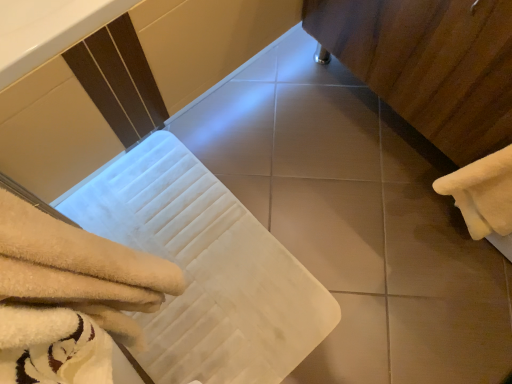
Question: From a real-world perspective, is white fluffy towel at lower left, arranged as the first towel when viewed from the left, located higher than wooden cabinet at right?

Choices:
 (A) yes
 (B) no

Answer: (A)

Question: Can you confirm if white fluffy towel at lower left, arranged as the first towel when viewed from the left, is taller than wooden cabinet at right?

Choices:
 (A) yes
 (B) no

Answer: (A)

Question: Does white fluffy towel at lower left, arranged as the first towel when viewed from the left, contain wooden cabinet at right?

Choices:
 (A) no
 (B) yes

Answer: (A)

Question: Is the position of white fluffy towel at lower left, arranged as the first towel when viewed from the left, more distant than that of wooden cabinet at right?

Choices:
 (A) yes
 (B) no

Answer: (B)

Question: From the image's perspective, is white fluffy towel at lower left, arranged as the first towel when viewed from the left, located above wooden cabinet at right?

Choices:
 (A) yes
 (B) no

Answer: (B)

Question: Would you say wooden cabinet at right is to the left or to the right of white fluffy towel at lower left, arranged as the second towel when viewed from the right, in the picture?

Choices:
 (A) left
 (B) right

Answer: (B)

Question: Is wooden cabinet at right in front of or behind white fluffy towel at lower left, arranged as the second towel when viewed from the right, in the image?

Choices:
 (A) behind
 (B) front

Answer: (A)

Question: From a real-world perspective, relative to white fluffy towel at lower left, arranged as the second towel when viewed from the right, is wooden cabinet at right vertically above or below?

Choices:
 (A) below
 (B) above

Answer: (A)

Question: Considering the positions of wooden cabinet at right and white fluffy towel at lower left, arranged as the second towel when viewed from the right, in the image, is wooden cabinet at right wider or thinner than white fluffy towel at lower left, arranged as the second towel when viewed from the right,?

Choices:
 (A) thin
 (B) wide

Answer: (B)

Question: Is point (465, 137) closer or farther from the camera than point (352, 276)?

Choices:
 (A) closer
 (B) farther

Answer: (A)

Question: Looking at their shapes, would you say wooden cabinet at right is wider or thinner than smooth beige tile at center?

Choices:
 (A) wide
 (B) thin

Answer: (A)

Question: Choose the correct answer: Is wooden cabinet at right inside smooth beige tile at center or outside it?

Choices:
 (A) inside
 (B) outside

Answer: (B)

Question: Considering the relative positions of wooden cabinet at right and smooth beige tile at center in the image provided, is wooden cabinet at right to the left or to the right of smooth beige tile at center?

Choices:
 (A) right
 (B) left

Answer: (A)

Question: From their relative heights in the image, would you say white fluffy towel at lower left, arranged as the second towel when viewed from the right, is taller or shorter than wooden cabinet at right?

Choices:
 (A) short
 (B) tall

Answer: (B)

Question: Do you think white fluffy towel at lower left, arranged as the first towel when viewed from the left, is within wooden cabinet at right, or outside of it?

Choices:
 (A) inside
 (B) outside

Answer: (B)